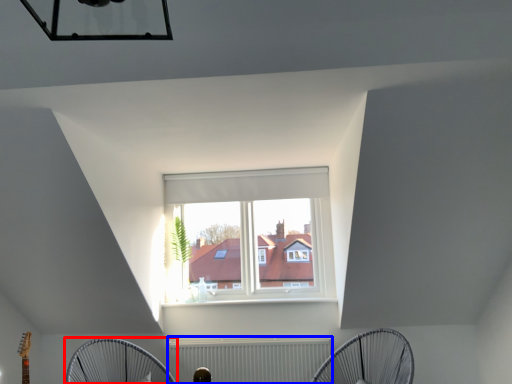
Question: Among these objects, which one is nearest to the camera, mechanical fan (highlighted by a red box) or radiator (highlighted by a blue box)?

Choices:
 (A) mechanical fan
 (B) radiator

Answer: (A)